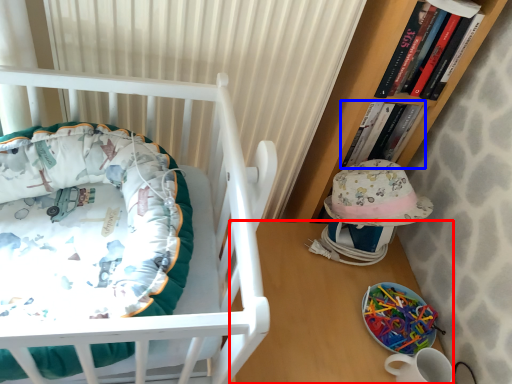
Question: Which of the following is the closest to the observer, table (highlighted by a red box) or book (highlighted by a blue box)?

Choices:
 (A) table
 (B) book

Answer: (A)